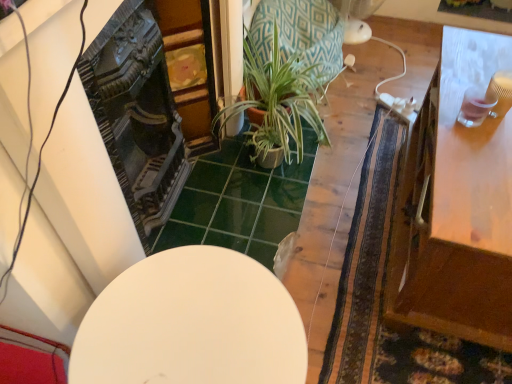
Find the location of a particular element. vacant region above white matte table at center, which ranks as the first table in left-to-right order (from a real-world perspective) is located at coordinates (199, 307).